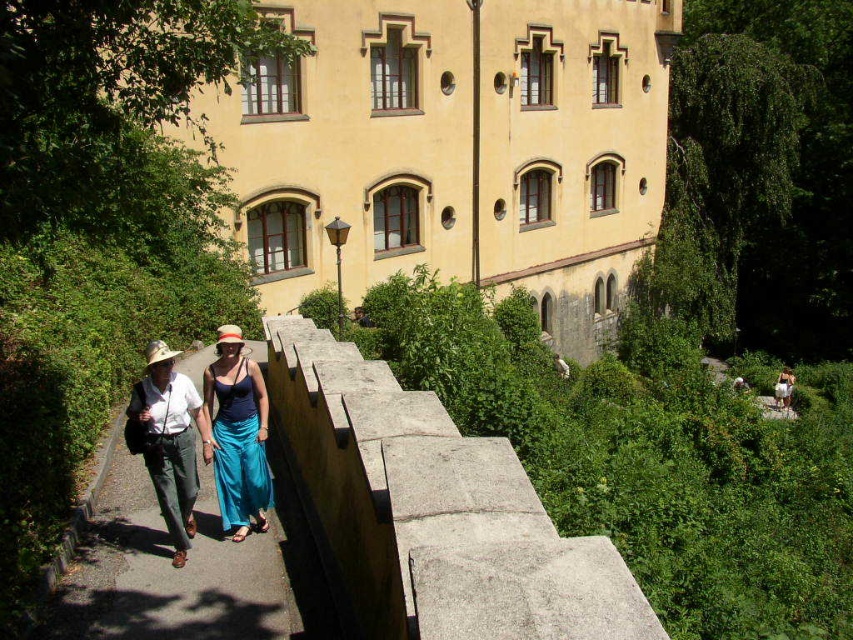
Is blue silk dress at center to the left of teal satin dress at center from the viewer's perspective?

Correct, you'll find blue silk dress at center to the left of teal satin dress at center.

Identify the location of blue silk dress at center. (200, 435).

Image resolution: width=853 pixels, height=640 pixels. I want to click on blue silk dress at center, so click(x=200, y=435).

What do you see at coordinates (456, 148) in the screenshot? I see `yellow stucco building at upper center` at bounding box center [456, 148].

This screenshot has width=853, height=640. In order to click on yellow stucco building at upper center in this screenshot , I will do `click(456, 148)`.

This screenshot has width=853, height=640. I want to click on yellow stucco building at upper center, so click(456, 148).

Based on the photo, who is positioned more to the right, concrete paved path at center or teal satin dress at center?

teal satin dress at center is more to the right.

Does concrete paved path at center appear on the left side of teal satin dress at center?

Indeed, concrete paved path at center is positioned on the left side of teal satin dress at center.

This screenshot has width=853, height=640. In order to click on concrete paved path at center in this screenshot , I will do `click(167, 573)`.

Where is `concrete paved path at center`? The width and height of the screenshot is (853, 640). concrete paved path at center is located at coordinates (167, 573).